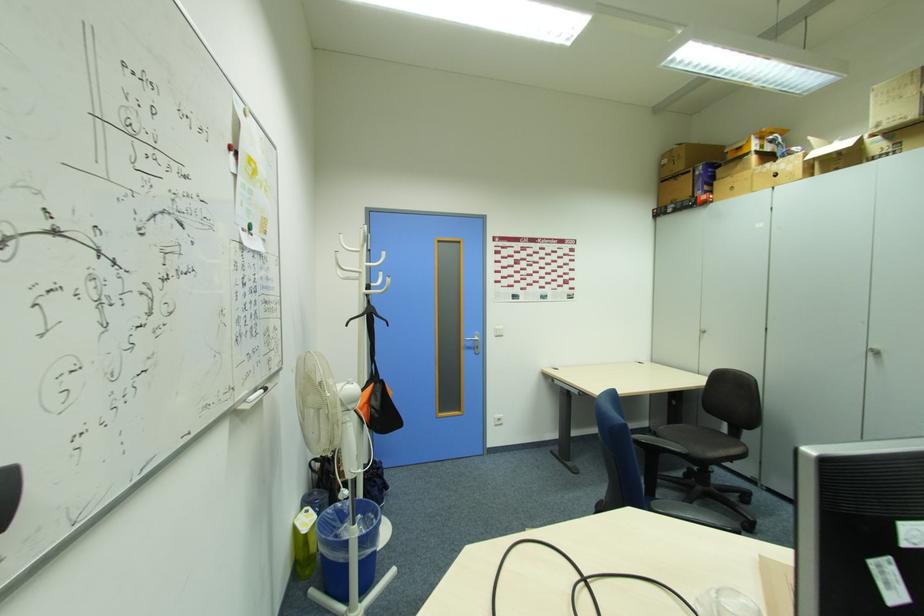
Identify the location of chair armrest. This screenshot has width=924, height=616. (653, 445).